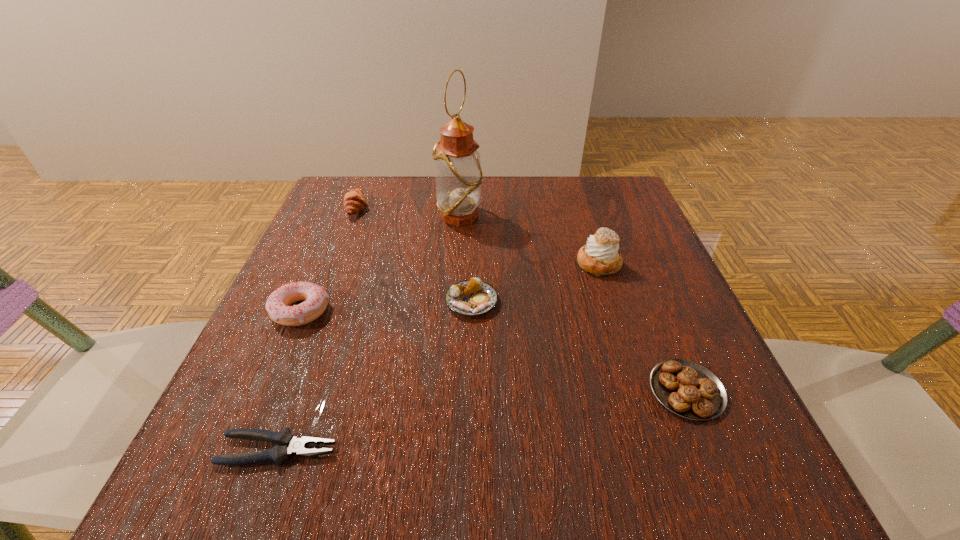
Where is `pastry at the left edge`? This screenshot has width=960, height=540. pastry at the left edge is located at coordinates (354, 201).

You are a GUI agent. You are given a task and a screenshot of the screen. Output one action in this format:
    pyautogui.click(x=<x>, y=<y>)
    Task: Click on the doughnut that is positioned at the left edge
    This screenshot has height=540, width=960.
    Given the screenshot: What is the action you would take?
    pyautogui.click(x=278, y=303)

You are a GUI agent. You are given a task and a screenshot of the screen. Output one action in this format:
    pyautogui.click(x=<x>, y=<y>)
    Task: Click on the pliers at the left edge
    
    Given the screenshot: What is the action you would take?
    point(289,445)

Locate an element on the screen. object located in the far left corner section of the desktop is located at coordinates (354, 201).

This screenshot has height=540, width=960. I want to click on object that is at the near left corner, so (289, 445).

Where is `free region at the far edge of the desktop`? The height and width of the screenshot is (540, 960). free region at the far edge of the desktop is located at coordinates (516, 214).

The image size is (960, 540). I want to click on vacant space at the near edge of the desktop, so click(x=447, y=440).

The image size is (960, 540). Identify the location of vacant space at the left edge. [318, 271].

Locate an element on the screen. This screenshot has height=540, width=960. vacant space at the right edge is located at coordinates (638, 282).

At what (x,y) coordinates should I click in order to perform the action: click on free space at the far left corner of the desktop. Please return your answer as a coordinate pair (x, y). This screenshot has height=540, width=960. Looking at the image, I should click on (354, 187).